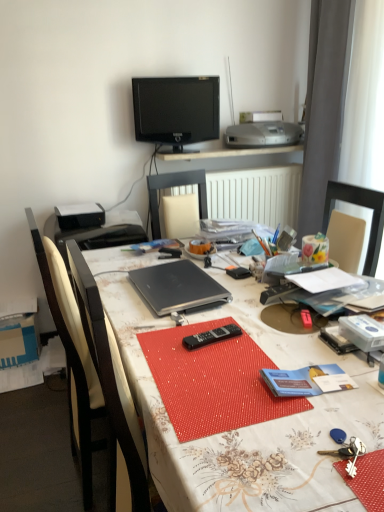
Identify the location of free spot in front of black plastic remote at center. This screenshot has width=384, height=512. (212, 372).